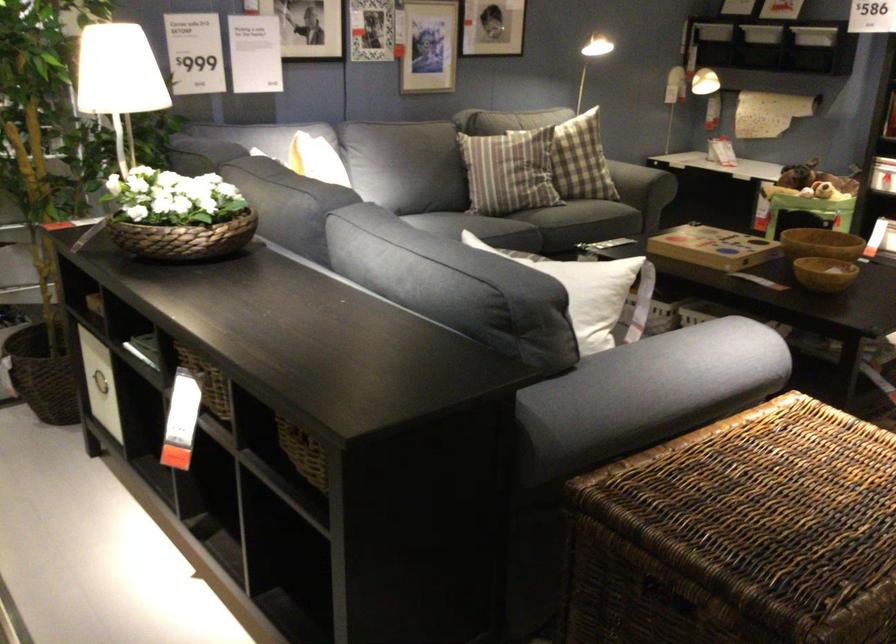
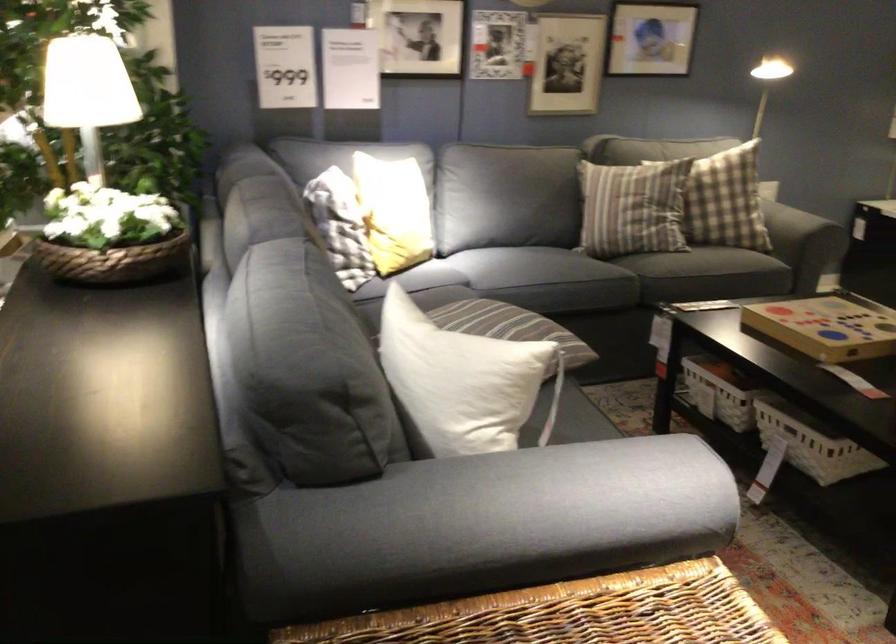
In a continuous first-person perspective shot, in which direction is the camera moving?

The cameraman walked toward right, forward.